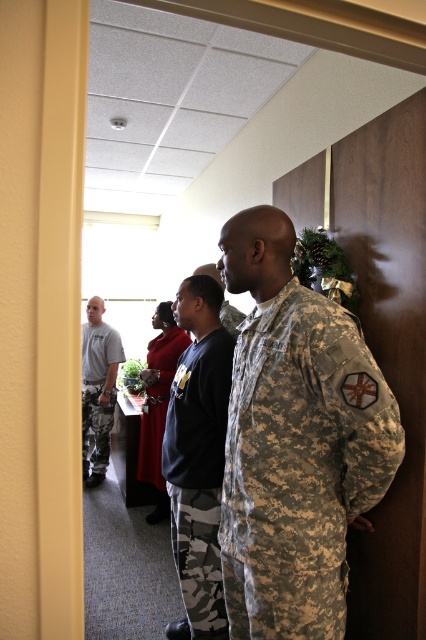
Question: Considering the real-world distances, which object is closest to the camouflage fabric uniform at center?

Choices:
 (A) camouflage fabric uniform at right
 (B) camo fabric uniform at center

Answer: (B)

Question: Does camouflage fabric uniform at right appear under camo fabric uniform at center?

Choices:
 (A) no
 (B) yes

Answer: (A)

Question: Does camouflage fabric uniform at right appear under camo fabric uniform at center?

Choices:
 (A) yes
 (B) no

Answer: (B)

Question: Which point is closer to the camera?

Choices:
 (A) camouflage fabric uniform at right
 (B) gray camo pants at left
 (C) camouflage uniform at center
 (D) camo fabric uniform at center

Answer: (A)

Question: Which of the following is the farthest from the observer?

Choices:
 (A) camo fabric uniform at center
 (B) camouflage fabric uniform at right

Answer: (A)

Question: From the image, what is the correct spatial relationship of gray camo pants at left in relation to camouflage fabric uniform at center?

Choices:
 (A) above
 (B) below

Answer: (A)